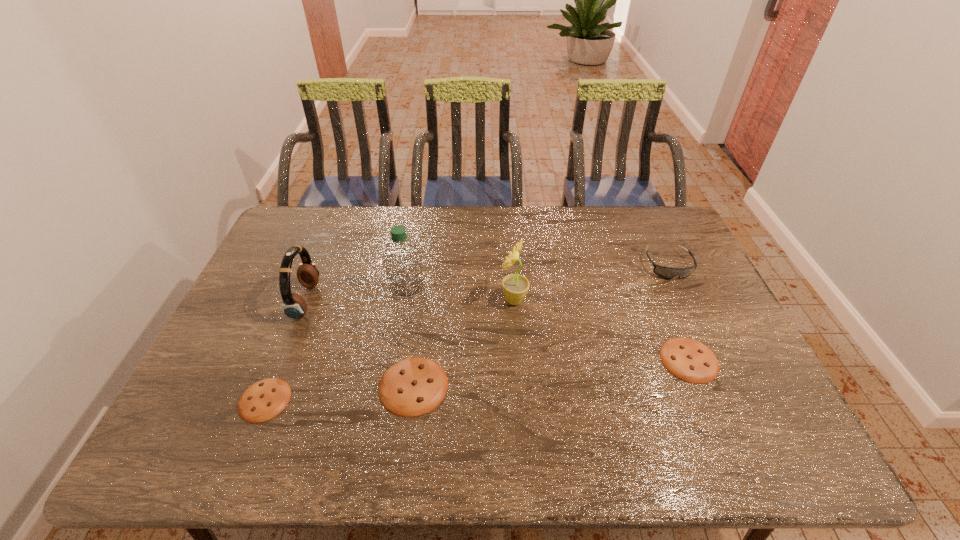
To achieve uniform spacing by inserting another cookie among them, please point to a free space for this new cookie. Please provide its 2D coordinates. Your answer should be formatted as a tuple, i.e. [(x, y)], where the tuple contains the x and y coordinates of a point satisfying the conditions above.

[(555, 373)]